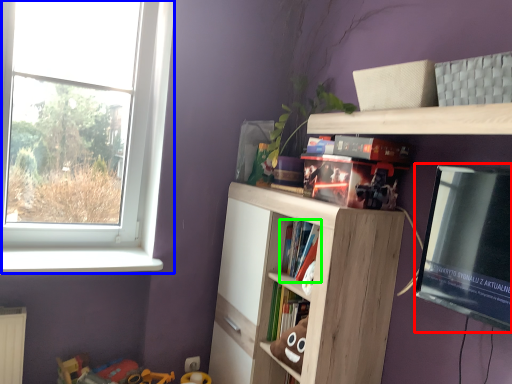
Question: Considering the real-world distances, which object is closest to window screen (highlighted by a red box)? window (highlighted by a blue box) or book (highlighted by a green box).

Choices:
 (A) window
 (B) book

Answer: (B)